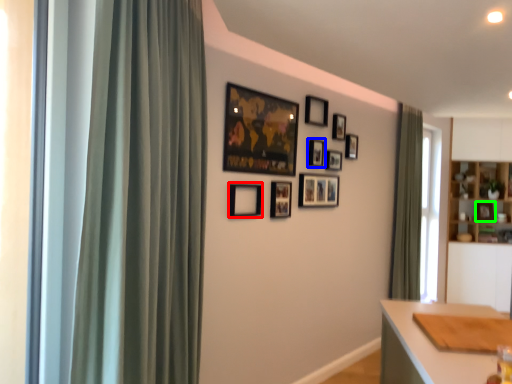
Question: Which object is positioned farthest from picture frame (highlighted by a red box)? Select from picture frame (highlighted by a blue box) and picture frame (highlighted by a green box).

Choices:
 (A) picture frame
 (B) picture frame

Answer: (B)